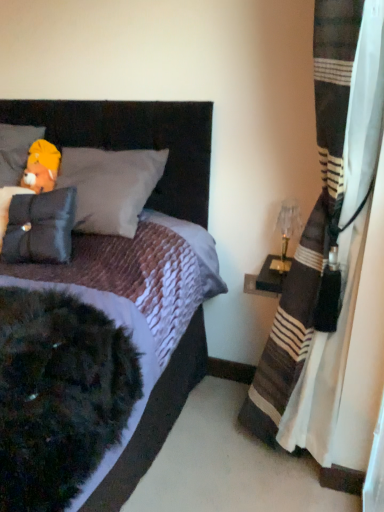
Question: Does matte black headboard at upper left lie in front of translucent glass table lamp at right?

Choices:
 (A) no
 (B) yes

Answer: (B)

Question: Is matte black headboard at upper left in contact with translucent glass table lamp at right?

Choices:
 (A) no
 (B) yes

Answer: (A)

Question: From the image's perspective, is matte black headboard at upper left under translucent glass table lamp at right?

Choices:
 (A) yes
 (B) no

Answer: (B)

Question: Is matte black headboard at upper left positioned far away from translucent glass table lamp at right?

Choices:
 (A) yes
 (B) no

Answer: (B)

Question: Considering the relative sizes of matte black headboard at upper left and translucent glass table lamp at right in the image provided, is matte black headboard at upper left thinner than translucent glass table lamp at right?

Choices:
 (A) no
 (B) yes

Answer: (A)

Question: Looking at their shapes, would you say velvet dark brown bed at center is wider or thinner than striped fabric curtain at right?

Choices:
 (A) wide
 (B) thin

Answer: (A)

Question: Is velvet dark brown bed at center to the left or to the right of striped fabric curtain at right in the image?

Choices:
 (A) left
 (B) right

Answer: (A)

Question: In the image, is velvet dark brown bed at center positioned in front of or behind striped fabric curtain at right?

Choices:
 (A) behind
 (B) front

Answer: (B)

Question: Choose the correct answer: Is velvet dark brown bed at center inside striped fabric curtain at right or outside it?

Choices:
 (A) inside
 (B) outside

Answer: (B)

Question: Relative to matte black headboard at upper left, is velvet dark brown bed at center in front or behind?

Choices:
 (A) behind
 (B) front

Answer: (B)

Question: Considering the relative positions of velvet dark brown bed at center and matte black headboard at upper left in the image provided, is velvet dark brown bed at center to the left or to the right of matte black headboard at upper left?

Choices:
 (A) left
 (B) right

Answer: (A)

Question: Considering the positions of velvet dark brown bed at center and matte black headboard at upper left in the image, is velvet dark brown bed at center wider or thinner than matte black headboard at upper left?

Choices:
 (A) wide
 (B) thin

Answer: (A)

Question: From the image's perspective, is velvet dark brown bed at center positioned above or below matte black headboard at upper left?

Choices:
 (A) above
 (B) below

Answer: (B)

Question: Considering the positions of point (139, 124) and point (281, 254), is point (139, 124) closer or farther from the camera than point (281, 254)?

Choices:
 (A) farther
 (B) closer

Answer: (B)

Question: Is velvet dark brown bed at center in front of or behind translucent glass table lamp at right in the image?

Choices:
 (A) behind
 (B) front

Answer: (B)